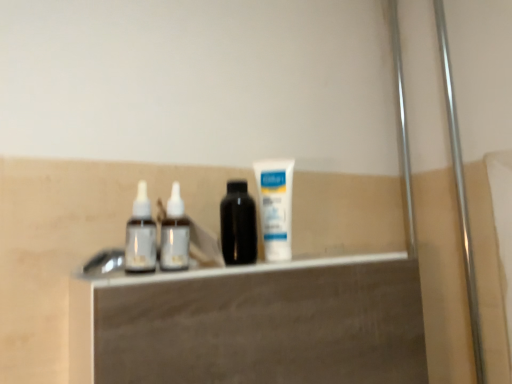
Find the location of a particular element. The image size is (512, 384). white matte tube at center is located at coordinates (275, 206).

What do you see at coordinates (275, 206) in the screenshot? This screenshot has width=512, height=384. I see `white matte tube at center` at bounding box center [275, 206].

The image size is (512, 384). What do you see at coordinates (253, 324) in the screenshot?
I see `white glossy vanity at center` at bounding box center [253, 324].

At what (x,y) coordinates should I click in order to perform the action: click on white glossy vanity at center. Please return your answer as a coordinate pair (x, y). Looking at the image, I should click on (253, 324).

Where is `white matte tube at center`? The image size is (512, 384). white matte tube at center is located at coordinates (275, 206).

In the image, is white glossy vanity at center on the left side or the right side of white matte tube at center?

white glossy vanity at center is to the left of white matte tube at center.

In the image, is white glossy vanity at center positioned in front of or behind white matte tube at center?

white glossy vanity at center is positioned closer to the viewer than white matte tube at center.

Which is behind, point (295, 347) or point (260, 202)?

Positioned behind is point (260, 202).

From the image's perspective, is white glossy vanity at center under white matte tube at center?

Indeed, from the image's perspective, white glossy vanity at center is shown beneath white matte tube at center.

From a real-world perspective, is white glossy vanity at center over white matte tube at center?

No.

Which object is wider, white glossy vanity at center or white matte tube at center?

With larger width is white glossy vanity at center.

Can you confirm if white glossy vanity at center is taller than white matte tube at center?

Indeed, white glossy vanity at center has a greater height compared to white matte tube at center.

Considering the relative sizes of white glossy vanity at center and white matte tube at center in the image provided, is white glossy vanity at center bigger than white matte tube at center?

Yes.

Do you think white glossy vanity at center is within white matte tube at center, or outside of it?

white glossy vanity at center cannot be found inside white matte tube at center.

Is white glossy vanity at center next to white matte tube at center?

No, white glossy vanity at center is not touching white matte tube at center.

Consider the image. Is white glossy vanity at center aimed at white matte tube at center?

No, white glossy vanity at center does not turn towards white matte tube at center.

Can you tell me how much white glossy vanity at center and white matte tube at center differ in facing direction?

The angular difference between white glossy vanity at center and white matte tube at center is 4.03 degrees.

Where is `toothpaste lying on the right of white glossy vanity at center`? The height and width of the screenshot is (384, 512). toothpaste lying on the right of white glossy vanity at center is located at coordinates (275, 206).

Which object is positioned more to the right, white matte tube at center or white glossy vanity at center?

From the viewer's perspective, white matte tube at center appears more on the right side.

Which object is more forward, white matte tube at center or white glossy vanity at center?

white glossy vanity at center is more forward.

Considering the positions of point (265, 201) and point (351, 365), is point (265, 201) closer or farther from the camera than point (351, 365)?

Point (265, 201) is farther from the camera than point (351, 365).

From the image's perspective, who appears lower, white matte tube at center or white glossy vanity at center?

From the image's view, white glossy vanity at center is below.

From a real-world perspective, is white matte tube at center physically located above or below white glossy vanity at center?

From a real-world perspective, white matte tube at center is physically above white glossy vanity at center.

Considering the sizes of objects white matte tube at center and white glossy vanity at center in the image provided, who is thinner, white matte tube at center or white glossy vanity at center?

white matte tube at center is thinner.

Based on the photo, considering the sizes of objects white matte tube at center and white glossy vanity at center in the image provided, who is taller, white matte tube at center or white glossy vanity at center?

Standing taller between the two is white glossy vanity at center.

Who is bigger, white matte tube at center or white glossy vanity at center?

With larger size is white glossy vanity at center.

Is white matte tube at center not inside white glossy vanity at center?

That's correct, white matte tube at center is outside of white glossy vanity at center.

Is white matte tube at center directly adjacent to white glossy vanity at center?

No.

Does white matte tube at center turn towards white glossy vanity at center?

No, white matte tube at center is not oriented towards white glossy vanity at center.

Locate an element on the screen. The image size is (512, 384). toothpaste located above the white glossy vanity at center (from the image's perspective) is located at coordinates (275, 206).

The height and width of the screenshot is (384, 512). Identify the location of toothpaste above the white glossy vanity at center (from the image's perspective). (275, 206).

In order to click on toothpaste on the right of white glossy vanity at center in this screenshot , I will do `click(275, 206)`.